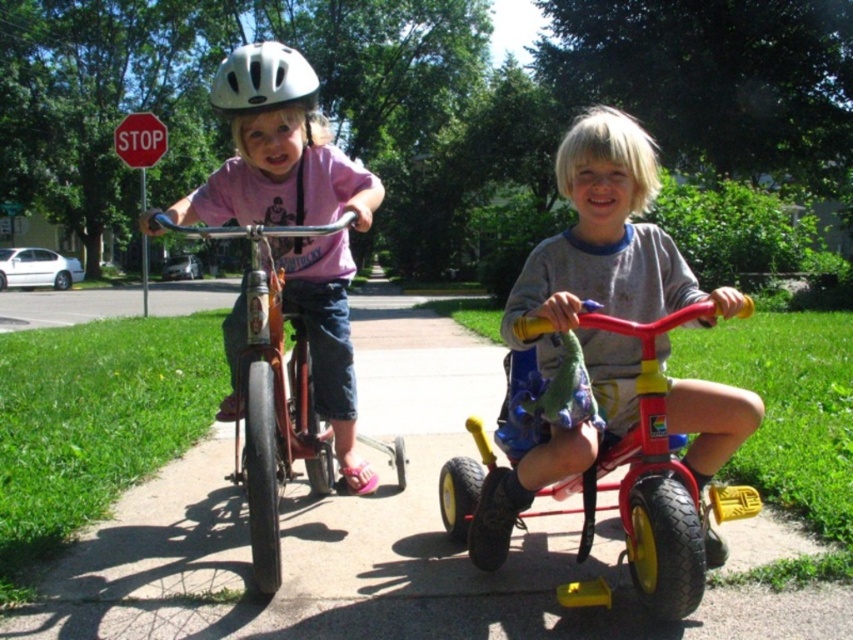
From the picture: Between orange matte bicycle at left and white matte helmet at upper center, which one has more height?

white matte helmet at upper center is taller.

The image size is (853, 640). I want to click on orange matte bicycle at left, so click(271, 394).

Does smooth concrete pavement at center appear under matte red tricycle at center?

Yes, smooth concrete pavement at center is below matte red tricycle at center.

Between smooth concrete pavement at center and matte red tricycle at center, which one appears on the left side from the viewer's perspective?

From the viewer's perspective, smooth concrete pavement at center appears more on the left side.

This screenshot has width=853, height=640. Describe the element at coordinates (370, 536) in the screenshot. I see `smooth concrete pavement at center` at that location.

What are the coordinates of `smooth concrete pavement at center` in the screenshot? It's located at (370, 536).

Who is higher up, matte red tricycle at center or white matte helmet at upper center?

white matte helmet at upper center is higher up.

Which is more to the right, matte red tricycle at center or white matte helmet at upper center?

From the viewer's perspective, matte red tricycle at center appears more on the right side.

Does point (704, 412) come behind point (277, 104)?

That is False.

This screenshot has height=640, width=853. I want to click on matte red tricycle at center, so click(606, 237).